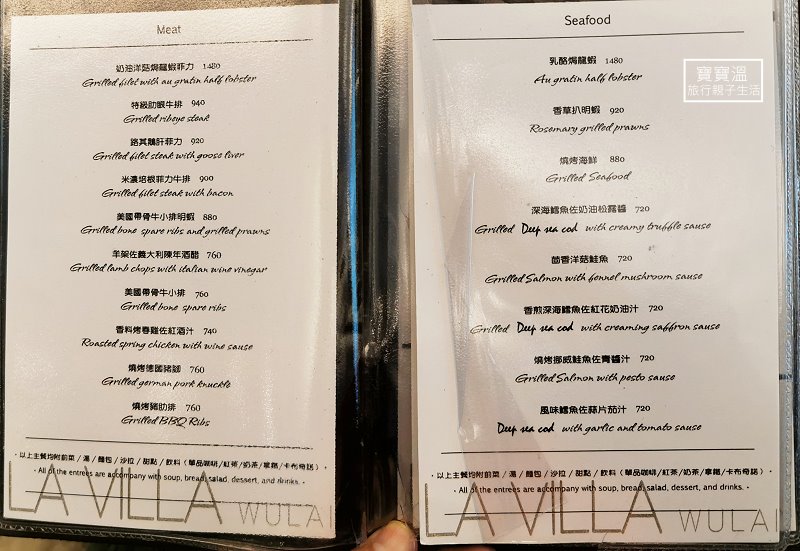
Image resolution: width=800 pixels, height=551 pixels. Find the location of `leather menu holder`. leather menu holder is located at coordinates (98, 540).